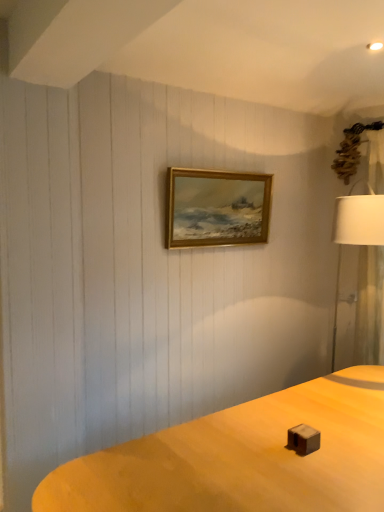
Question: Is gold wooden picture frame at center to the left of white fabric lampshade at right from the viewer's perspective?

Choices:
 (A) yes
 (B) no

Answer: (A)

Question: From the image's perspective, is gold wooden picture frame at center on white fabric lampshade at right?

Choices:
 (A) yes
 (B) no

Answer: (A)

Question: From the image's perspective, would you say gold wooden picture frame at center is shown under white fabric lampshade at right?

Choices:
 (A) no
 (B) yes

Answer: (A)

Question: Is gold wooden picture frame at center shorter than white fabric lampshade at right?

Choices:
 (A) no
 (B) yes

Answer: (B)

Question: Can you confirm if gold wooden picture frame at center is bigger than white fabric lampshade at right?

Choices:
 (A) no
 (B) yes

Answer: (A)

Question: Does gold wooden picture frame at center have a greater width compared to white fabric lampshade at right?

Choices:
 (A) no
 (B) yes

Answer: (A)

Question: Is white fabric lampshade at right turned away from gold wooden picture frame at center?

Choices:
 (A) yes
 (B) no

Answer: (B)

Question: From a real-world perspective, is white fabric lampshade at right on gold wooden picture frame at center?

Choices:
 (A) yes
 (B) no

Answer: (B)

Question: Is gold wooden picture frame at center surrounded by white fabric lampshade at right?

Choices:
 (A) no
 (B) yes

Answer: (A)

Question: Can you confirm if white fabric lampshade at right is smaller than gold wooden picture frame at center?

Choices:
 (A) no
 (B) yes

Answer: (A)

Question: Are white fabric lampshade at right and gold wooden picture frame at center far apart?

Choices:
 (A) no
 (B) yes

Answer: (A)

Question: From the image's perspective, would you say white fabric lampshade at right is shown under gold wooden picture frame at center?

Choices:
 (A) yes
 (B) no

Answer: (A)

Question: From the image's perspective, is white fabric lampshade at right above or below gold wooden picture frame at center?

Choices:
 (A) below
 (B) above

Answer: (A)